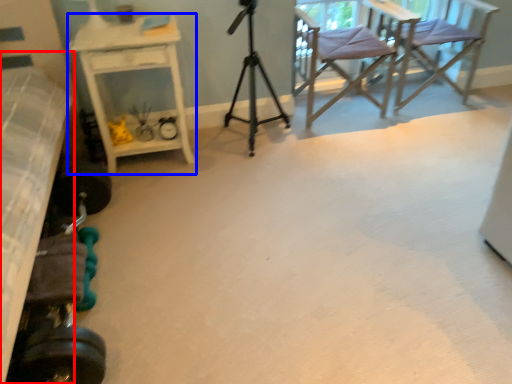
Question: Which object appears closest to the camera in this image, bed (highlighted by a red box) or desk (highlighted by a blue box)?

Choices:
 (A) bed
 (B) desk

Answer: (A)